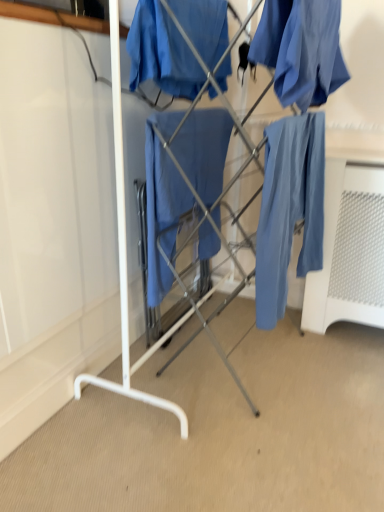
Question: Are matte blue pants at right and matte blue fabric at center far apart?

Choices:
 (A) yes
 (B) no

Answer: (B)

Question: Does matte blue pants at right have a smaller size compared to matte blue fabric at center?

Choices:
 (A) yes
 (B) no

Answer: (A)

Question: Is matte blue pants at right shorter than matte blue fabric at center?

Choices:
 (A) yes
 (B) no

Answer: (A)

Question: Is matte blue pants at right at the right side of matte blue fabric at center?

Choices:
 (A) yes
 (B) no

Answer: (A)

Question: Is matte blue pants at right thinner than matte blue fabric at center?

Choices:
 (A) no
 (B) yes

Answer: (B)

Question: Based on their sizes in the image, would you say matte blue pants at right is bigger or smaller than matte blue fabric at center?

Choices:
 (A) small
 (B) big

Answer: (B)

Question: Is matte blue pants at right situated inside matte blue fabric at center or outside?

Choices:
 (A) inside
 (B) outside

Answer: (B)

Question: Looking at their shapes, would you say matte blue pants at right is wider or thinner than matte blue fabric at center?

Choices:
 (A) thin
 (B) wide

Answer: (B)

Question: Visually, is matte blue pants at right positioned to the left or to the right of matte blue fabric at center?

Choices:
 (A) left
 (B) right

Answer: (B)

Question: Considering the relative positions of matte blue pants at right and matte blue fabric at center, the first clothing from the left, in the image provided, is matte blue pants at right to the left or to the right of matte blue fabric at center, the first clothing from the left,?

Choices:
 (A) left
 (B) right

Answer: (B)

Question: From the image's perspective, is matte blue pants at right positioned above or below matte blue fabric at center, the first clothing from the left?

Choices:
 (A) above
 (B) below

Answer: (B)

Question: Is matte blue pants at right taller or shorter than matte blue fabric at center, the 2th clothing viewed from the right?

Choices:
 (A) tall
 (B) short

Answer: (A)

Question: From a real-world perspective, is matte blue pants at right above or below matte blue fabric at center, the first clothing from the left?

Choices:
 (A) above
 (B) below

Answer: (B)

Question: In terms of size, does matte blue fabric at upper right, which ranks as the 1th clothing in right-to-left order, appear bigger or smaller than matte blue pants at right?

Choices:
 (A) big
 (B) small

Answer: (B)

Question: From their relative heights in the image, would you say matte blue fabric at upper right, which ranks as the 1th clothing in right-to-left order, is taller or shorter than matte blue pants at right?

Choices:
 (A) short
 (B) tall

Answer: (A)